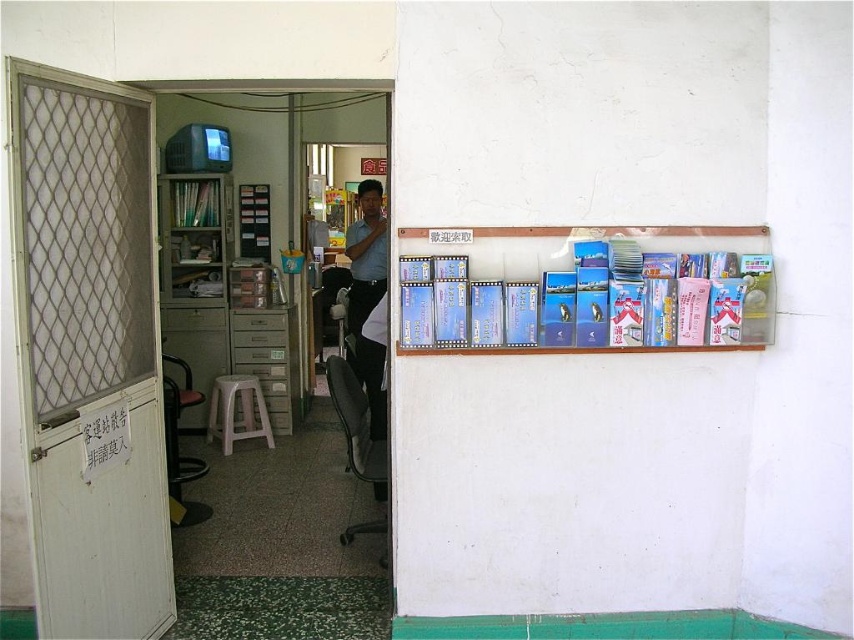
You are a visitor in this office and need to pick up both the clear plastic cards at upper right and the white plastic stool at lower center. Which item should you reach for first based on their positions?

The clear plastic cards at upper right are closer to you, so you should reach for the clear plastic cards at upper right first before the white plastic stool at lower center.

You are a delivery person who just arrived at the office. You need to place a package that requires a 36 inch clearance between the recipient and a seating area. The recipient is wearing the matte blue shirt at center and there is a white plastic stool at lower center. Can you safely place the package between them?

The matte blue shirt at center and white plastic stool at lower center are 37.38 inches apart from each other. Since the required clearance is 36 inches, the distance is sufficient, so yes, you can safely place the package between them.

You are standing in the office and need to hand a document to the person wearing the matte blue shirt at center. The document is too large to carry through the doorway. Can you reach the person by moving around the matte plastic bookshelf at left?

The matte plastic bookshelf at left is to the left of the matte blue shirt at center, so you can move around the bookshelf to reach the person wearing the matte blue shirt at center.